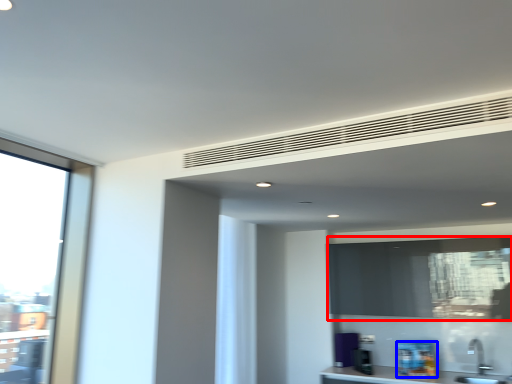
Question: Which object appears farthest to the camera in this image, window screen (highlighted by a red box) or appliance (highlighted by a blue box)?

Choices:
 (A) window screen
 (B) appliance

Answer: (B)